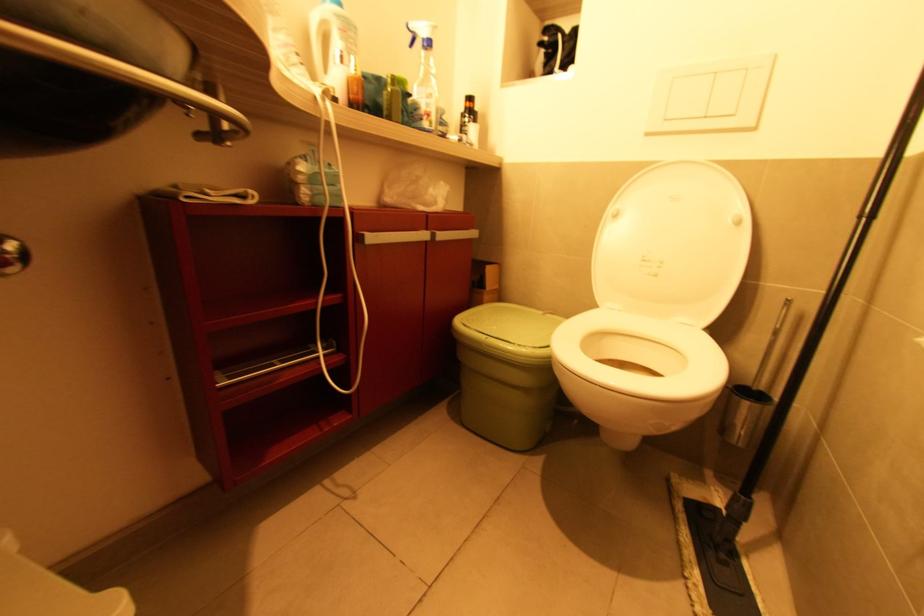
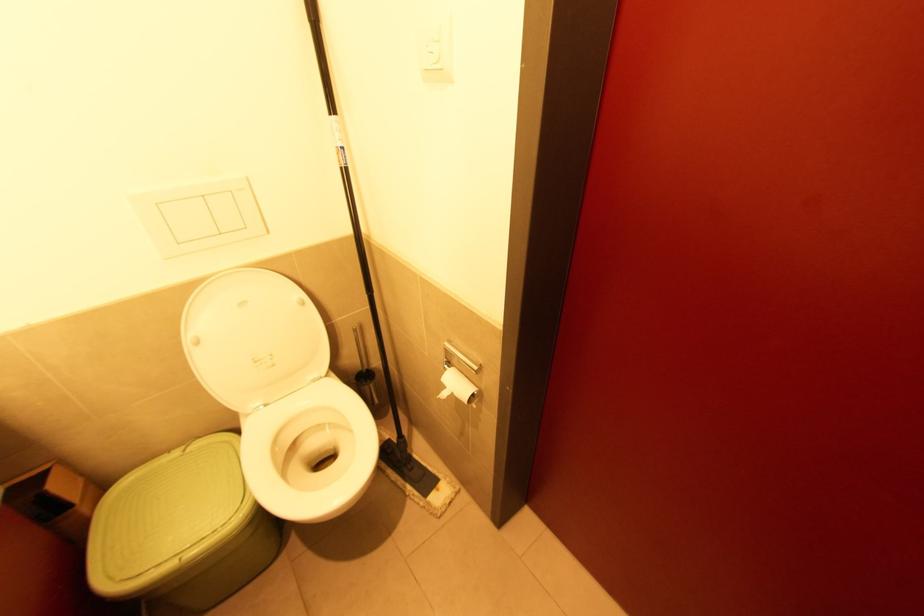
Locate, in the second image, the point that corresponds to the point at 617,217 in the first image.

(200, 342)